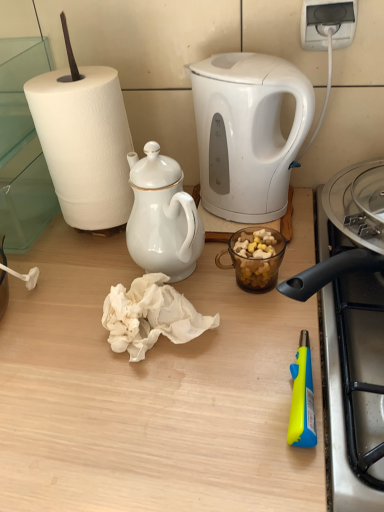
The width and height of the screenshot is (384, 512). I want to click on free space in front of translucent glass mug at center, so click(x=243, y=368).